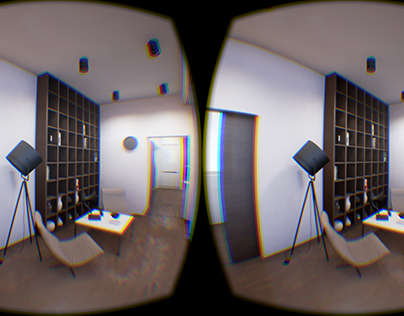
At what (x,y) coordinates should I click in order to perform the action: click on door. Please return your answer as a coordinate pair (x, y). Image resolution: width=404 pixels, height=316 pixels. Looking at the image, I should click on 234,155.